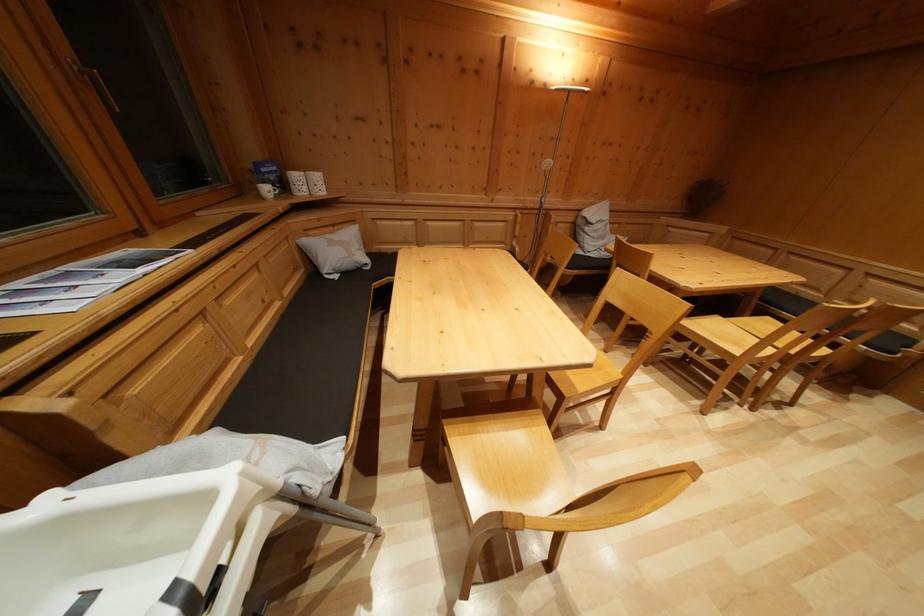
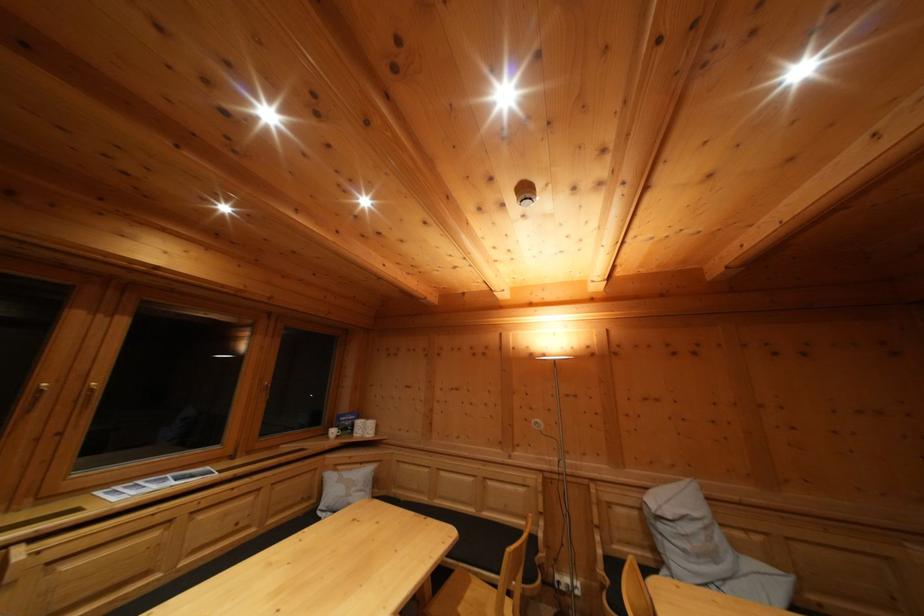
Find the pixel in the second image that matches pixel 507 249 in the first image.

(532, 525)